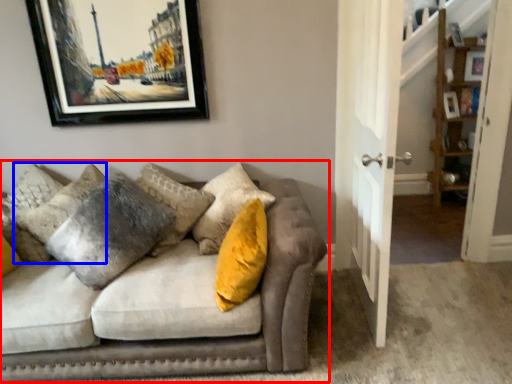
Question: Which object appears closest to the camera in this image, studio couch (highlighted by a red box) or pillow (highlighted by a blue box)?

Choices:
 (A) studio couch
 (B) pillow

Answer: (A)